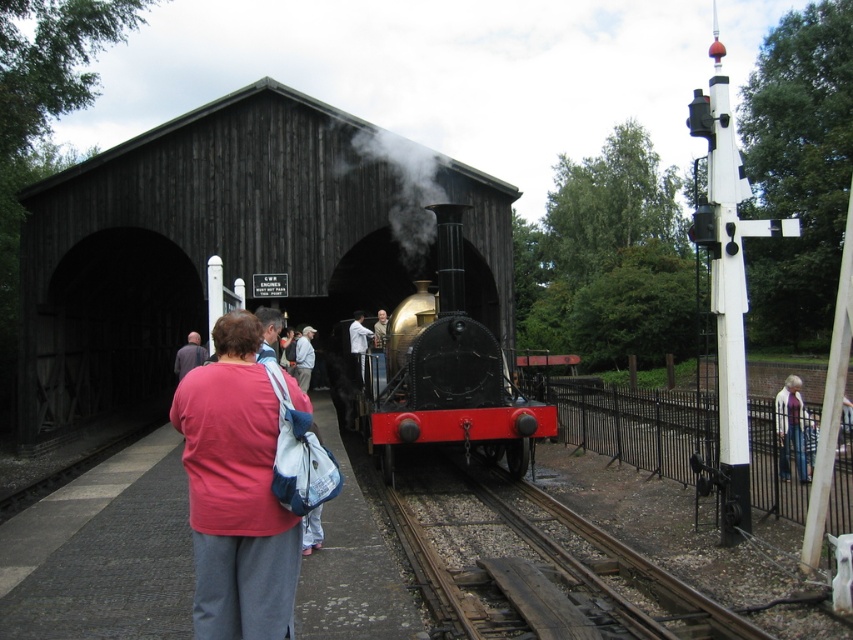
Who is shorter, smooth metal train track at center or dark blue shirt at left?

Result: With less height is smooth metal train track at center.

Based on the photo, is smooth metal train track at center to the left of dark blue shirt at left from the viewer's perspective?

No, smooth metal train track at center is not to the left of dark blue shirt at left.

Is point (476, 614) positioned in front of point (202, 346)?

Yes, point (476, 614) is in front of point (202, 346).

Locate an element on the screen. The height and width of the screenshot is (640, 853). smooth metal train track at center is located at coordinates (548, 563).

Is white shirt at center shorter than light brown leather jacket at center?

No, white shirt at center is not shorter than light brown leather jacket at center.

Which is more to the right, white shirt at center or light brown leather jacket at center?

From the viewer's perspective, light brown leather jacket at center appears more on the right side.

This screenshot has width=853, height=640. Describe the element at coordinates (358, 340) in the screenshot. I see `white shirt at center` at that location.

Where is `white shirt at center`? The image size is (853, 640). white shirt at center is located at coordinates [358, 340].

Is point (387, 156) positioned after point (206, 356)?

Yes, point (387, 156) is farther from viewer.

Does black smoke at center have a smaller size compared to dark blue shirt at left?

Correct, black smoke at center occupies less space than dark blue shirt at left.

Describe the element at coordinates (403, 188) in the screenshot. I see `black smoke at center` at that location.

Where is `black smoke at center`? This screenshot has height=640, width=853. black smoke at center is located at coordinates (403, 188).